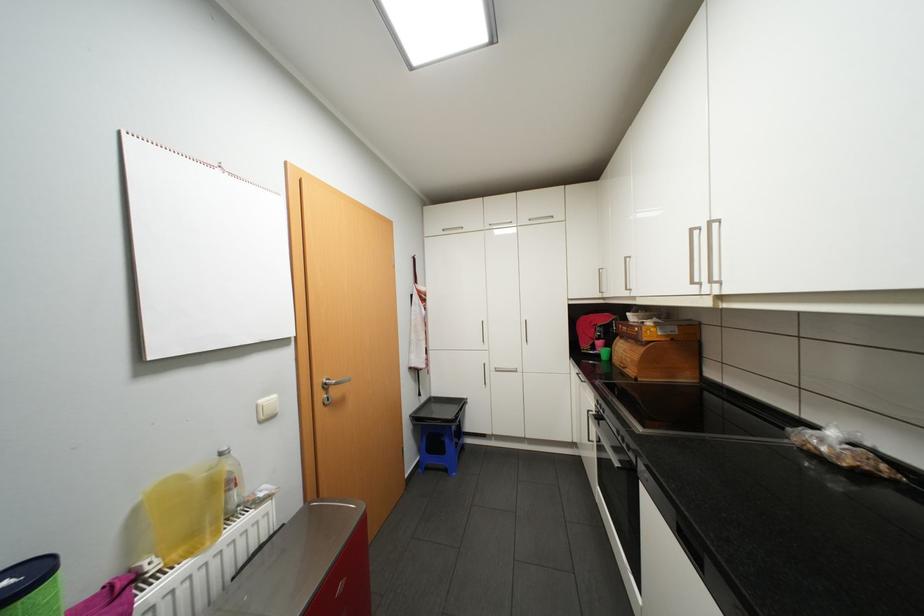
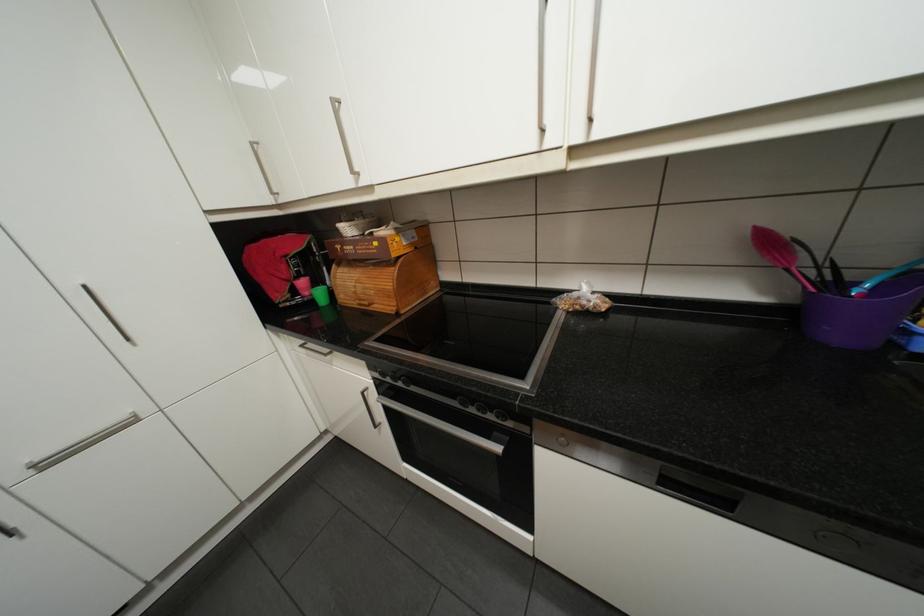
From the picture: How did the camera likely rotate?

The rotation direction of the camera is right-down.